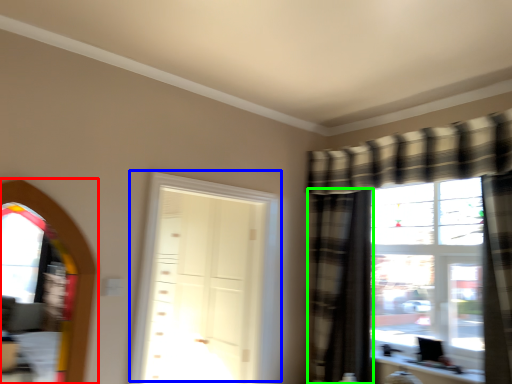
Question: Based on their relative distances, which object is farther from window screen (highlighted by a red box)? Choose from door (highlighted by a blue box) and curtain (highlighted by a green box).

Choices:
 (A) door
 (B) curtain

Answer: (B)